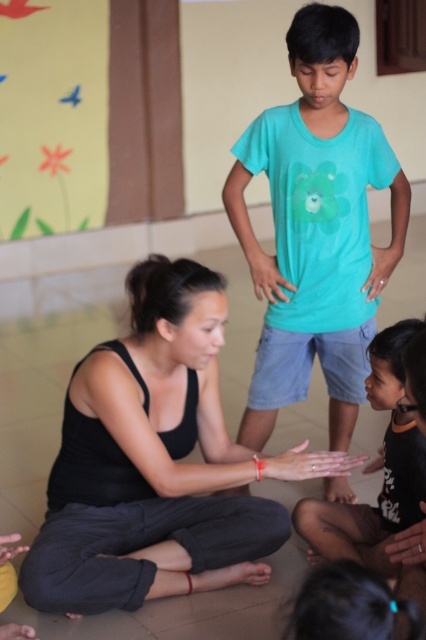
You are a photographer trying to capture a candid shot of the black matte tank top at center and the dark brown skin at lower right. Since you want both subjects to be in focus, you need to know which one is closer to the camera. Can you determine which is closer?

The black matte tank top at center has a larger size compared to dark brown skin at lower right, which means the black matte tank top at center is closer to the camera.